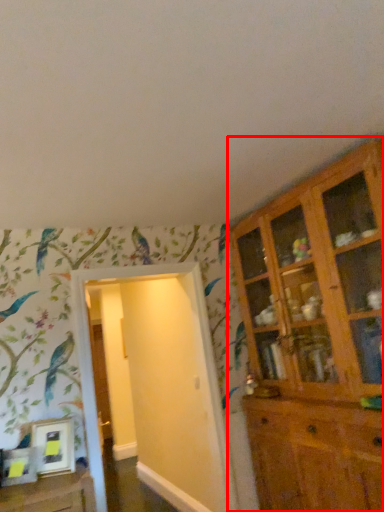
Question: From the image's perspective, considering the relative positions of cupboard (annotated by the red box) and door in the image provided, where is cupboard (annotated by the red box) located with respect to the staircase?

Choices:
 (A) below
 (B) above

Answer: (B)